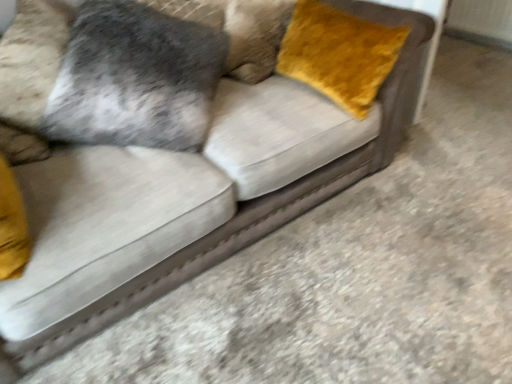
In order to face velvet gray pillow at upper left, should I rotate leftwards or rightwards?

To align with it, rotate left about 12.896°.

Find the location of a particular element. velvet gray pillow at upper left is located at coordinates (136, 78).

The height and width of the screenshot is (384, 512). What do you see at coordinates (136, 78) in the screenshot? I see `velvet gray pillow at upper left` at bounding box center [136, 78].

Where is `velvet yellow pillow at upper right`? This screenshot has width=512, height=384. velvet yellow pillow at upper right is located at coordinates (339, 54).

The height and width of the screenshot is (384, 512). What do you see at coordinates (339, 54) in the screenshot?
I see `velvet yellow pillow at upper right` at bounding box center [339, 54].

Find the location of a particular element. velvet gray pillow at upper left is located at coordinates (136, 78).

Would you say velvet yellow pillow at upper right is to the left or to the right of velvet gray pillow at upper left in the picture?

Based on their positions, velvet yellow pillow at upper right is located to the right of velvet gray pillow at upper left.

Is velvet yellow pillow at upper right positioned in front of velvet gray pillow at upper left?

Yes.

Is point (364, 66) farther from viewer compared to point (157, 63)?

Yes, point (364, 66) is farther from viewer.

From the image's perspective, which object appears higher, velvet yellow pillow at upper right or velvet gray pillow at upper left?

velvet gray pillow at upper left is shown above in the image.

From a real-world perspective, who is located lower, velvet yellow pillow at upper right or velvet gray pillow at upper left?

velvet yellow pillow at upper right.

Considering the sizes of objects velvet yellow pillow at upper right and velvet gray pillow at upper left in the image provided, who is thinner, velvet yellow pillow at upper right or velvet gray pillow at upper left?

Thinner between the two is velvet yellow pillow at upper right.

Who is taller, velvet yellow pillow at upper right or velvet gray pillow at upper left?

velvet yellow pillow at upper right is taller.

Does velvet yellow pillow at upper right have a smaller size compared to velvet gray pillow at upper left?

Yes.

In the scene shown: Is velvet yellow pillow at upper right inside the boundaries of velvet gray pillow at upper left, or outside?

velvet yellow pillow at upper right lies outside velvet gray pillow at upper left.

Is velvet yellow pillow at upper right placed right next to velvet gray pillow at upper left?

velvet yellow pillow at upper right and velvet gray pillow at upper left are clearly separated.

Is velvet yellow pillow at upper right positioned with its back to velvet gray pillow at upper left?

velvet yellow pillow at upper right does not have its back to velvet gray pillow at upper left.

How distant is velvet yellow pillow at upper right from velvet gray pillow at upper left?

velvet yellow pillow at upper right and velvet gray pillow at upper left are 58.28 centimeters apart.

Image resolution: width=512 pixels, height=384 pixels. Identify the location of pillow that appears on the left of velvet yellow pillow at upper right. (136, 78).

Which is more to the left, velvet gray pillow at upper left or velvet yellow pillow at upper right?

From the viewer's perspective, velvet gray pillow at upper left appears more on the left side.

Is velvet gray pillow at upper left closer to the viewer compared to velvet yellow pillow at upper right?

That is False.

Is point (152, 17) positioned in front of point (345, 82)?

That is True.

From the image's perspective, relative to velvet yellow pillow at upper right, is velvet gray pillow at upper left above or below?

Based on their image positions, velvet gray pillow at upper left is located above velvet yellow pillow at upper right.

From a real-world perspective, is velvet gray pillow at upper left above or below velvet yellow pillow at upper right?

velvet gray pillow at upper left is situated higher than velvet yellow pillow at upper right in the real world.

Is velvet gray pillow at upper left thinner than velvet yellow pillow at upper right?

No, velvet gray pillow at upper left is not thinner than velvet yellow pillow at upper right.

Who is taller, velvet gray pillow at upper left or velvet yellow pillow at upper right?

velvet yellow pillow at upper right.

Considering the relative sizes of velvet gray pillow at upper left and velvet yellow pillow at upper right in the image provided, is velvet gray pillow at upper left smaller than velvet yellow pillow at upper right?

No, velvet gray pillow at upper left is not smaller than velvet yellow pillow at upper right.

Is velvet gray pillow at upper left completely or partially outside of velvet yellow pillow at upper right?

Absolutely, velvet gray pillow at upper left is external to velvet yellow pillow at upper right.

Are velvet gray pillow at upper left and velvet yellow pillow at upper right beside each other?

No, velvet gray pillow at upper left is not with velvet yellow pillow at upper right.

Is velvet yellow pillow at upper right at the back of velvet gray pillow at upper left?

No, velvet gray pillow at upper left's orientation is not away from velvet yellow pillow at upper right.

Can you tell me how much velvet gray pillow at upper left and velvet yellow pillow at upper right differ in facing direction?

The angular difference between velvet gray pillow at upper left and velvet yellow pillow at upper right is 67.2 degrees.

This screenshot has width=512, height=384. I want to click on pillow located above the velvet yellow pillow at upper right (from the image's perspective), so click(136, 78).

Locate an element on the screen. pillow behind the velvet yellow pillow at upper right is located at coordinates (136, 78).

Where is `pillow that appears above the velvet yellow pillow at upper right (from a real-world perspective)`? pillow that appears above the velvet yellow pillow at upper right (from a real-world perspective) is located at coordinates coord(136,78).